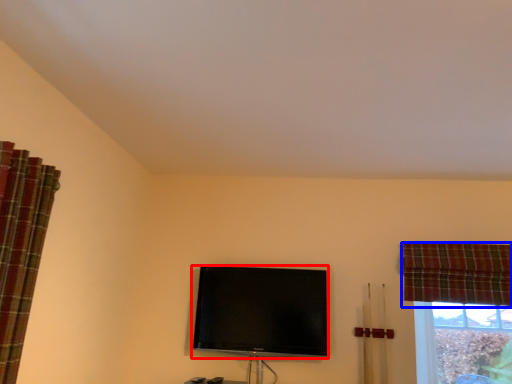
Question: Among these objects, which one is nearest to the camera, television (highlighted by a red box) or curtain (highlighted by a blue box)?

Choices:
 (A) television
 (B) curtain

Answer: (B)